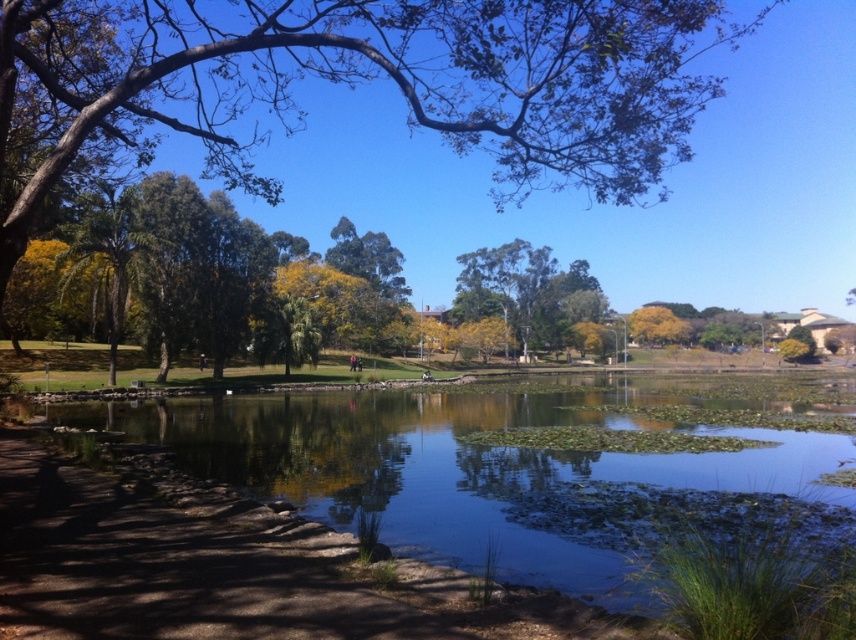
Question: Which point appears farthest from the camera in this image?

Choices:
 (A) (x=623, y=28)
 (B) (x=718, y=419)

Answer: (B)

Question: Is green leafy tree at upper center bigger than clear water at center?

Choices:
 (A) yes
 (B) no

Answer: (A)

Question: Among these points, which one is nearest to the camera?

Choices:
 (A) (162, 51)
 (B) (849, 465)

Answer: (B)

Question: Considering the relative positions of green leafy tree at upper center and clear water at center in the image provided, where is green leafy tree at upper center located with respect to clear water at center?

Choices:
 (A) left
 (B) right

Answer: (A)

Question: Can you confirm if green leafy tree at upper center is bigger than clear water at center?

Choices:
 (A) yes
 (B) no

Answer: (A)